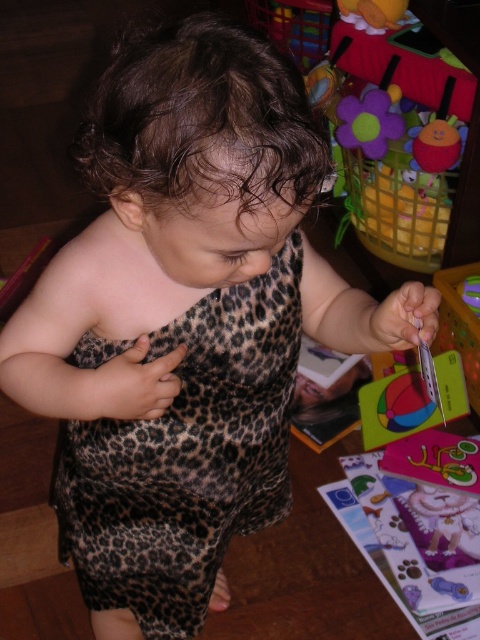
Who is positioned more to the left, leopard print fabric dress at center or fluffy fabric flower at upper right?

Positioned to the left is leopard print fabric dress at center.

Consider the image. Can you confirm if leopard print fabric dress at center is positioned to the right of fluffy fabric flower at upper right?

Incorrect, leopard print fabric dress at center is not on the right side of fluffy fabric flower at upper right.

The height and width of the screenshot is (640, 480). I want to click on leopard print fabric dress at center, so click(187, 458).

The image size is (480, 640). I want to click on leopard print fabric dress at center, so click(x=187, y=458).